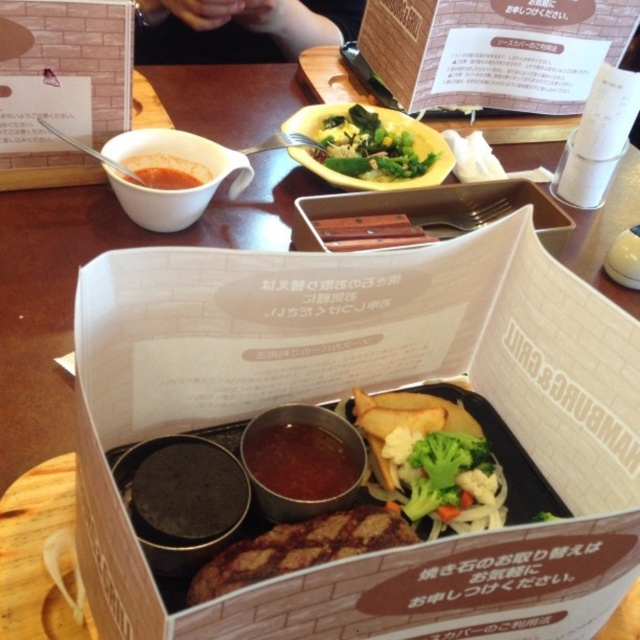
Question: Is matte white bowl at upper left thinner than thick brown sauce at center?

Choices:
 (A) no
 (B) yes

Answer: (A)

Question: Which of the following is the farthest from the observer?

Choices:
 (A) green leafy vegetables at center
 (B) matte white bowl at upper left
 (C) thick brown sauce at center
 (D) white cardboard box at upper center

Answer: (D)

Question: Which object is positioned closest to the white cardboard box at upper center?

Choices:
 (A) matte white bowl at upper left
 (B) green leafy vegetables at center
 (C) thick brown sauce at center

Answer: (B)

Question: Can you confirm if matte white bowl at upper left is wider than thick brown sauce at center?

Choices:
 (A) yes
 (B) no

Answer: (A)

Question: Which object is farther from the camera taking this photo?

Choices:
 (A) white cardboard box at upper center
 (B) thick brown sauce at center
 (C) matte white bowl at upper left
 (D) green leafy vegetables at center

Answer: (A)

Question: Does white cardboard box at upper center have a larger size compared to thick brown sauce at center?

Choices:
 (A) yes
 (B) no

Answer: (A)